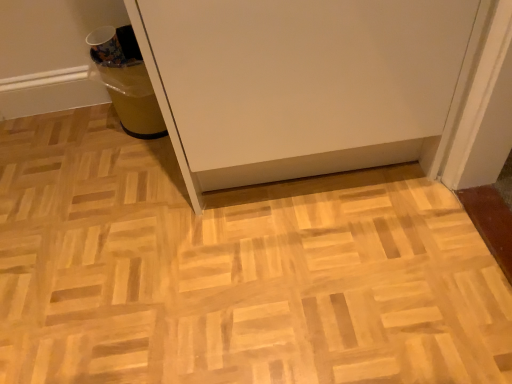
Identify the location of blank space above natural wood parquet floor at center (from a real-world perspective). The height and width of the screenshot is (384, 512). (167, 236).